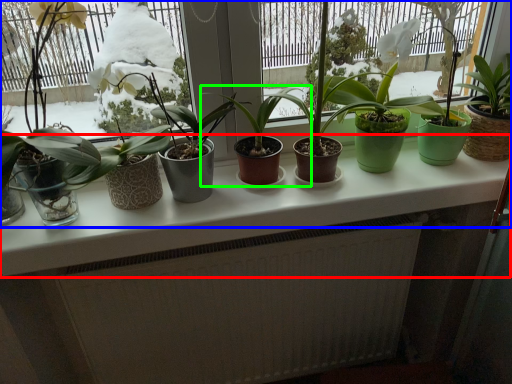
Question: Which object is positioned farthest from counter top (highlighted by a red box)? Select from houseplant (highlighted by a blue box) and houseplant (highlighted by a green box).

Choices:
 (A) houseplant
 (B) houseplant

Answer: (A)